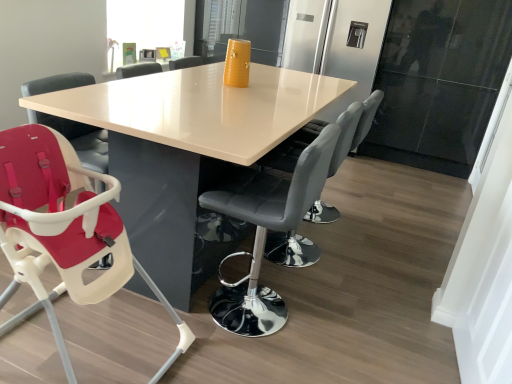
Question: Is matte white highchair at lower left, positioned as the third chair in right-to-left order, positioned far away from black leather bar stool at center, which is the second chair in left-to-right order?

Choices:
 (A) yes
 (B) no

Answer: (B)

Question: Is matte white highchair at lower left, positioned as the 1th chair in left-to-right order, at the left side of black leather bar stool at center, the 2th chair viewed from the right?

Choices:
 (A) no
 (B) yes

Answer: (B)

Question: Is matte white highchair at lower left, positioned as the 1th chair in left-to-right order, outside black leather bar stool at center, the 2th chair viewed from the right?

Choices:
 (A) yes
 (B) no

Answer: (A)

Question: Is matte white highchair at lower left, positioned as the 1th chair in left-to-right order, looking in the opposite direction of black leather bar stool at center, the 2th chair viewed from the right?

Choices:
 (A) no
 (B) yes

Answer: (A)

Question: Can you confirm if matte white highchair at lower left, positioned as the third chair in right-to-left order, is bigger than black leather bar stool at center, the 2th chair viewed from the right?

Choices:
 (A) yes
 (B) no

Answer: (A)

Question: From the image's perspective, is transparent glass window screen at upper left positioned above or below matte black chair at center, placed as the third chair when sorted from left to right?

Choices:
 (A) above
 (B) below

Answer: (A)

Question: In terms of height, does transparent glass window screen at upper left look taller or shorter compared to matte black chair at center, placed as the third chair when sorted from left to right?

Choices:
 (A) tall
 (B) short

Answer: (B)

Question: Is point (130, 24) positioned closer to the camera than point (376, 107)?

Choices:
 (A) farther
 (B) closer

Answer: (A)

Question: From a real-world perspective, relative to matte black chair at center, placed as the third chair when sorted from left to right, is transparent glass window screen at upper left vertically above or below?

Choices:
 (A) below
 (B) above

Answer: (B)

Question: Is matte white highchair at lower left, positioned as the third chair in right-to-left order, bigger or smaller than white glossy table at center?

Choices:
 (A) small
 (B) big

Answer: (A)

Question: Is matte white highchair at lower left, positioned as the third chair in right-to-left order, spatially inside white glossy table at center, or outside of it?

Choices:
 (A) inside
 (B) outside

Answer: (B)

Question: From the image's perspective, is matte white highchair at lower left, positioned as the 1th chair in left-to-right order, above or below white glossy table at center?

Choices:
 (A) below
 (B) above

Answer: (A)

Question: Considering the positions of point (31, 182) and point (160, 122), is point (31, 182) closer or farther from the camera than point (160, 122)?

Choices:
 (A) closer
 (B) farther

Answer: (A)

Question: Is transparent glass window screen at upper left wider or thinner than matte white highchair at lower left, positioned as the 1th chair in left-to-right order?

Choices:
 (A) wide
 (B) thin

Answer: (B)

Question: Considering the positions of transparent glass window screen at upper left and matte white highchair at lower left, positioned as the third chair in right-to-left order, in the image, is transparent glass window screen at upper left taller or shorter than matte white highchair at lower left, positioned as the third chair in right-to-left order,?

Choices:
 (A) tall
 (B) short

Answer: (B)